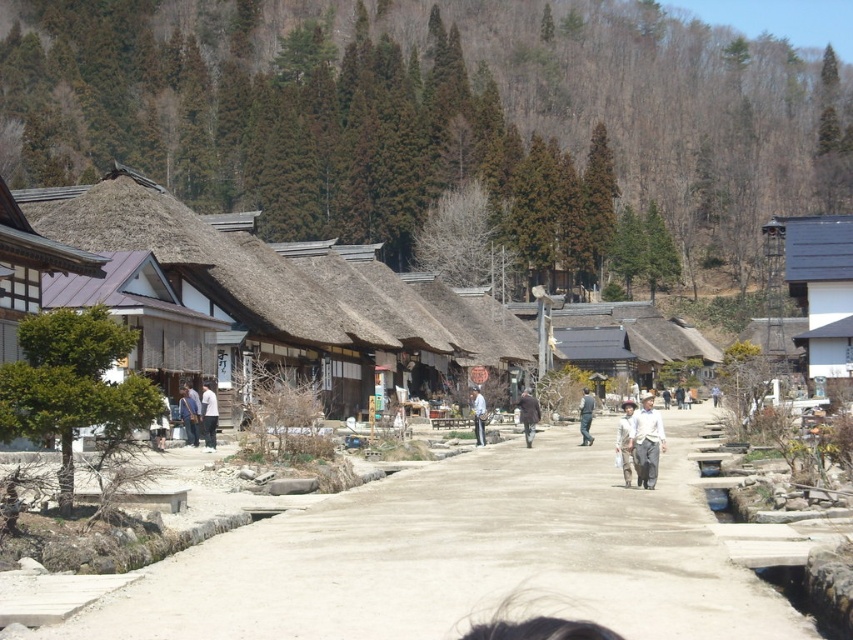
Consider the image. Which of these two, white cotton shirt at center or light brown wooden pole at center, stands taller?

Standing taller between the two is light brown wooden pole at center.

Is white cotton shirt at center further to camera compared to light brown wooden pole at center?

No, it is not.

Between point (200, 403) and point (477, 433), which one is positioned in front?

Point (200, 403) is in front.

Locate an element on the screen. This screenshot has height=640, width=853. white cotton shirt at center is located at coordinates (207, 417).

From the picture: Is green grassy hillside at upper center in front of light brown wooden pole at center?

No, green grassy hillside at upper center is behind light brown wooden pole at center.

Is green grassy hillside at upper center shorter than light brown wooden pole at center?

No.

Which is in front, point (753, 104) or point (476, 410)?

Point (476, 410) is more forward.

Identify the location of green grassy hillside at upper center. (422, 108).

This screenshot has height=640, width=853. Describe the element at coordinates (422, 108) in the screenshot. I see `green grassy hillside at upper center` at that location.

Which is in front, point (308, 54) or point (630, 456)?

Positioned in front is point (630, 456).

This screenshot has width=853, height=640. Find the location of `green grassy hillside at upper center`. green grassy hillside at upper center is located at coordinates (422, 108).